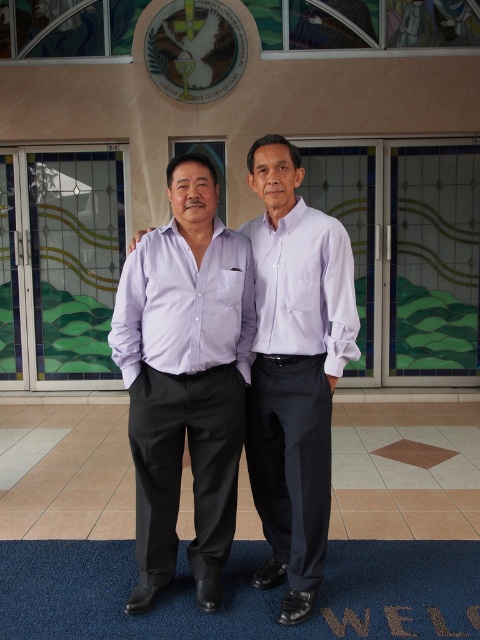
In the scene shown: Who is positioned more to the right, blue carpet at lower center or lavender cotton shirt at center?

blue carpet at lower center is more to the right.

Based on the photo, which of these two, blue carpet at lower center or lavender cotton shirt at center, stands taller?

lavender cotton shirt at center is taller.

Does point (82, 556) lie in front of point (205, 337)?

No, it is not.

This screenshot has height=640, width=480. I want to click on blue carpet at lower center, so click(x=241, y=593).

Is lavender cotton shirt at center shorter than white smooth shirt at center?

Indeed, lavender cotton shirt at center has a lesser height compared to white smooth shirt at center.

Between lavender cotton shirt at center and white smooth shirt at center, which one is positioned higher?

white smooth shirt at center is higher up.

Is point (120, 317) positioned behind point (347, 241)?

Yes, point (120, 317) is farther from viewer.

You are a GUI agent. You are given a task and a screenshot of the screen. Output one action in this format:
    pyautogui.click(x=<x>, y=<y>)
    Task: Click on the lavender cotton shirt at center
    The height and width of the screenshot is (640, 480).
    Given the screenshot: What is the action you would take?
    (x=184, y=305)

Does matte purple shirt at center appear over white smooth shirt at center?

No, matte purple shirt at center is not above white smooth shirt at center.

Which is below, matte purple shirt at center or white smooth shirt at center?

matte purple shirt at center

Is point (261, 506) less distant than point (348, 253)?

No, it is not.

This screenshot has height=640, width=480. Identify the location of matte purple shirt at center. (295, 369).